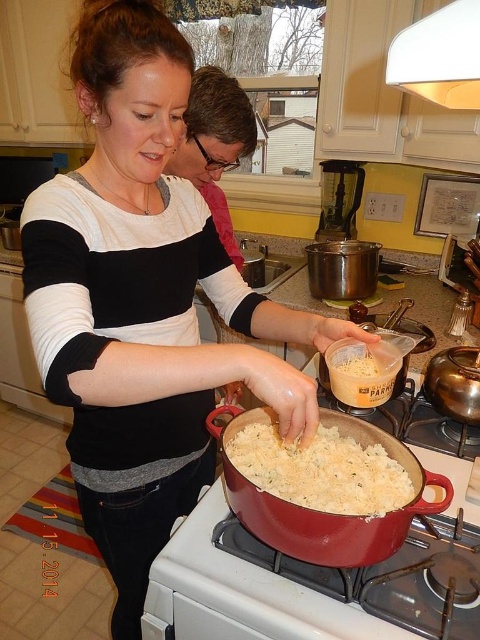
From the picture: You are a chef trying to add seasoning to the dish. You have the white creamy rice at center and the white powder container at center in front of you. Which one should you use to measure the powder?

The white powder container at center is smaller in size than the white creamy rice at center, so you should use the white creamy rice at center to measure the powder.

You are a chef standing in the kitchen and need to locate the white creamy rice at center. According to the coordinates provided, where exactly is it positioned in the image?

The white creamy rice at center is located at the coordinates point [322,470].

You are a chef in a kitchen with a white creamy rice at center and a white powder container at center. You need to sprinkle some powder from the container onto the rice. Can you reach the container without moving your position?

The distance between the white creamy rice at center and the white powder container at center is 7.43 inches, so yes, you can reach the container without moving your position since the distance is manageable.